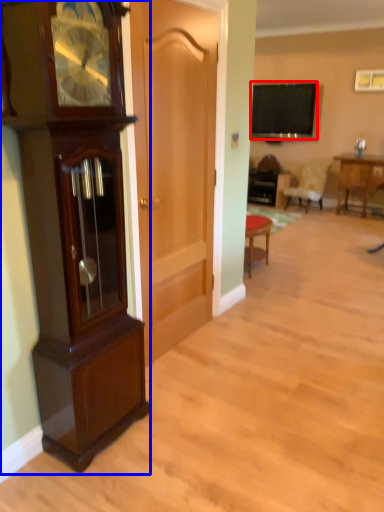
Question: Which of the following is the closest to the observer, television (highlighted by a red box) or cabinetry (highlighted by a blue box)?

Choices:
 (A) television
 (B) cabinetry

Answer: (B)